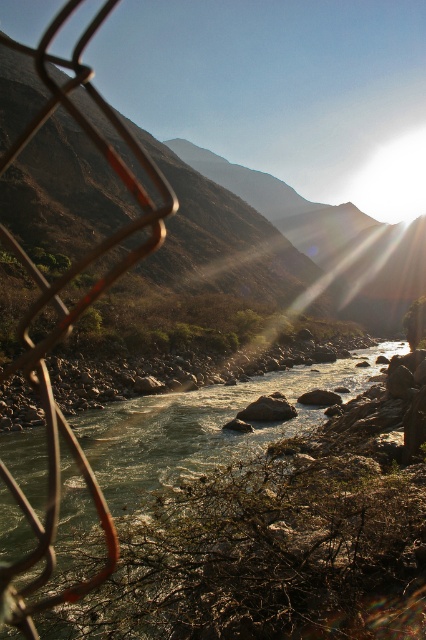
You are standing at the point with coordinates (203,422) in the image. Looking around, you see a greenish brown rocky stream at center. What is located at your current position?

At point (203,422) lies greenish brown rocky stream at center.